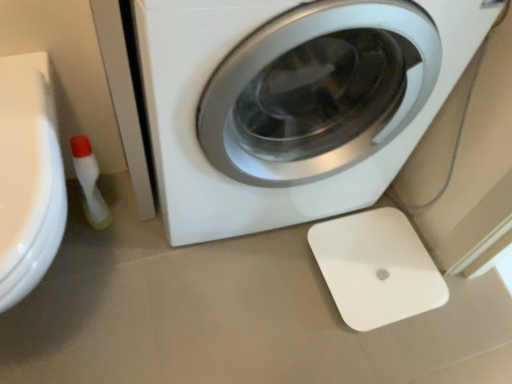
Identify the location of free space in front of white plastic scale at lower right. Image resolution: width=512 pixels, height=384 pixels. (366, 351).